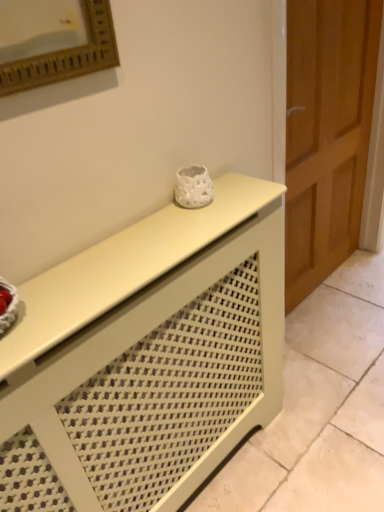
Question: Is matte white console table at center a part of wooden door at right?

Choices:
 (A) yes
 (B) no

Answer: (B)

Question: Is wooden door at right in contact with matte white console table at center?

Choices:
 (A) no
 (B) yes

Answer: (A)

Question: Considering the relative positions of wooden door at right and matte white console table at center in the image provided, is wooden door at right to the left of matte white console table at center from the viewer's perspective?

Choices:
 (A) yes
 (B) no

Answer: (B)

Question: Is wooden door at right not within matte white console table at center?

Choices:
 (A) yes
 (B) no

Answer: (A)

Question: Is wooden door at right thinner than matte white console table at center?

Choices:
 (A) no
 (B) yes

Answer: (B)

Question: From the image's perspective, is wooden door at right over matte white console table at center?

Choices:
 (A) yes
 (B) no

Answer: (A)

Question: Can you confirm if matte white console table at center is smaller than wooden door at right?

Choices:
 (A) no
 (B) yes

Answer: (B)

Question: From a real-world perspective, is matte white console table at center on top of wooden door at right?

Choices:
 (A) yes
 (B) no

Answer: (B)

Question: Is matte white console table at center bigger than wooden door at right?

Choices:
 (A) no
 (B) yes

Answer: (A)

Question: Would you say wooden door at right is part of matte white console table at center's contents?

Choices:
 (A) no
 (B) yes

Answer: (A)

Question: Does matte white console table at center have a lesser height compared to wooden door at right?

Choices:
 (A) yes
 (B) no

Answer: (A)

Question: Is matte white console table at center in front of wooden door at right?

Choices:
 (A) no
 (B) yes

Answer: (B)

Question: Would you say matte white console table at center is to the left or to the right of wooden door at right in the picture?

Choices:
 (A) left
 (B) right

Answer: (A)